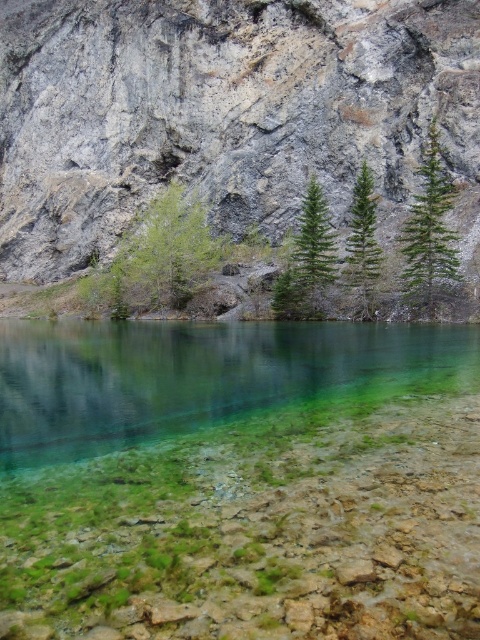
Question: Which point is closer to the camera?

Choices:
 (A) green needle-like tree at center
 (B) green pine tree at upper right
 (C) gray rock mountain at upper center

Answer: (B)

Question: Considering the real-world distances, which object is farthest from the green needle-like tree at center?

Choices:
 (A) green matte tree at center
 (B) clear glassy water at center

Answer: (A)

Question: Which object is positioned farthest from the green pine tree at upper right?

Choices:
 (A) green matte tree at center
 (B) green needle-like tree at center
 (C) green textured pine tree at center
 (D) gray rock mountain at upper center

Answer: (D)

Question: Is green pine tree at upper right to the right of green textured pine tree at center from the viewer's perspective?

Choices:
 (A) no
 (B) yes

Answer: (B)

Question: Can you confirm if gray rock mountain at upper center is positioned to the right of green textured pine tree at center?

Choices:
 (A) yes
 (B) no

Answer: (B)

Question: In this image, where is clear glassy water at center located relative to green pine tree at upper right?

Choices:
 (A) left
 (B) right

Answer: (A)